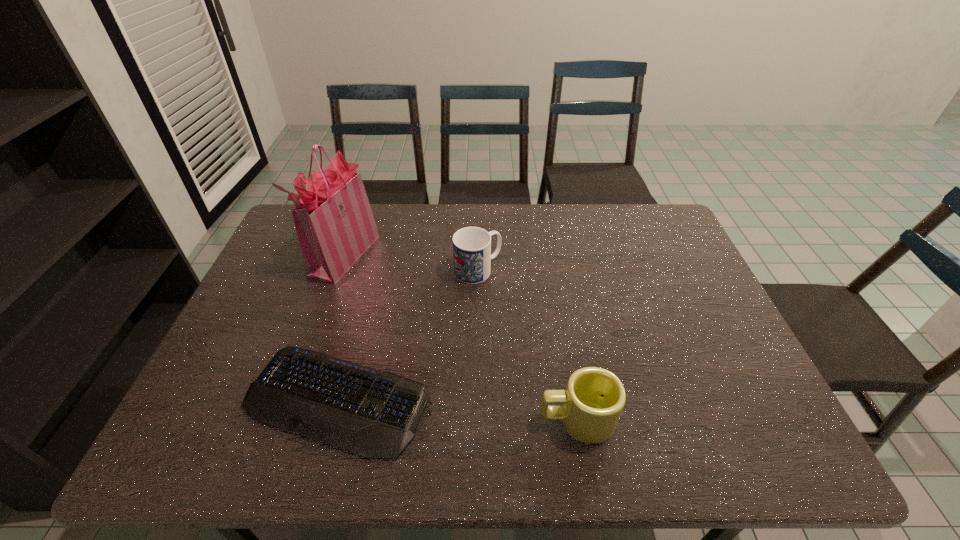
In order to click on blank region between the computer keyboard and the tallest object in this screenshot , I will do `click(342, 327)`.

Identify the location of unoccupied area between the computer keyboard and the farther mug. (408, 335).

Locate an element on the screen. The image size is (960, 540). free spot between the shopping bag and the computer keyboard is located at coordinates (342, 327).

Where is `vacant area that lies between the farther mug and the shortest object`? vacant area that lies between the farther mug and the shortest object is located at coordinates (408, 335).

The image size is (960, 540). What are the coordinates of `object that is the second closest to the farther mug` in the screenshot? It's located at (334, 222).

Identify which object is located as the third nearest to the tallest object. Please provide its 2D coordinates. Your answer should be formatted as a tuple, i.e. [(x, y)], where the tuple contains the x and y coordinates of a point satisfying the conditions above.

[(594, 398)]

You are a GUI agent. You are given a task and a screenshot of the screen. Output one action in this format:
    pyautogui.click(x=<x>, y=<y>)
    Task: Click on the vacant space that satisfies the following two spatial constraints: 1. on the front side of the tallest object; 2. on the right side of the second object from right to left
    This screenshot has height=540, width=960.
    Given the screenshot: What is the action you would take?
    pyautogui.click(x=340, y=270)

Locate an element on the screen. Image resolution: width=960 pixels, height=540 pixels. vacant space that satisfies the following two spatial constraints: 1. on the back side of the computer keyboard; 2. on the left side of the second object from right to left is located at coordinates (372, 270).

Find the location of a particular element. vacant space that satisfies the following two spatial constraints: 1. on the front side of the shopping bag; 2. on the right side of the left mug is located at coordinates pos(340,270).